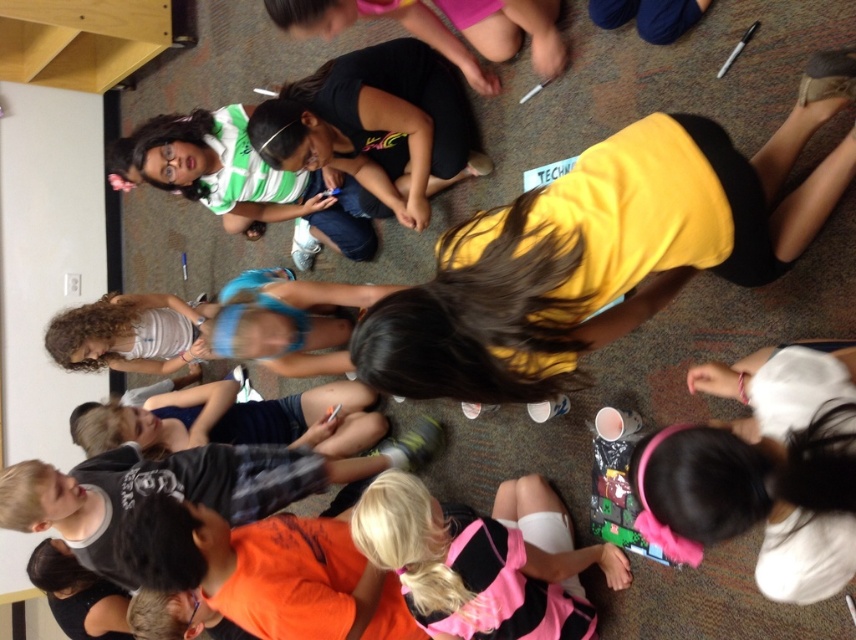
Between point (489, 538) and point (183, 410), which one is positioned behind?

Positioned behind is point (183, 410).

Who is higher up, pink fabric at lower center or dark blue fabric at center?

dark blue fabric at center is above.

This screenshot has width=856, height=640. In order to click on pink fabric at lower center in this screenshot , I will do `click(484, 561)`.

Does point (749, 184) come farther from viewer compared to point (479, 84)?

No, it is in front of (479, 84).

Does yellow matte shirt at center appear on the left side of pink fabric at upper center?

In fact, yellow matte shirt at center is to the right of pink fabric at upper center.

Image resolution: width=856 pixels, height=640 pixels. What do you see at coordinates (604, 250) in the screenshot?
I see `yellow matte shirt at center` at bounding box center [604, 250].

At what (x,y) coordinates should I click in order to perform the action: click on yellow matte shirt at center. Please return your answer as a coordinate pair (x, y). The height and width of the screenshot is (640, 856). Looking at the image, I should click on (604, 250).

Is orange matte shirt at center smaller than dark blue fabric at center?

Yes, orange matte shirt at center is smaller than dark blue fabric at center.

From the picture: Does orange matte shirt at center have a lesser width compared to dark blue fabric at center?

Yes.

In the scene shown: Who is more forward, [159,540] or [336,388]?

Positioned in front is point [159,540].

Identify the location of orange matte shirt at center. (262, 570).